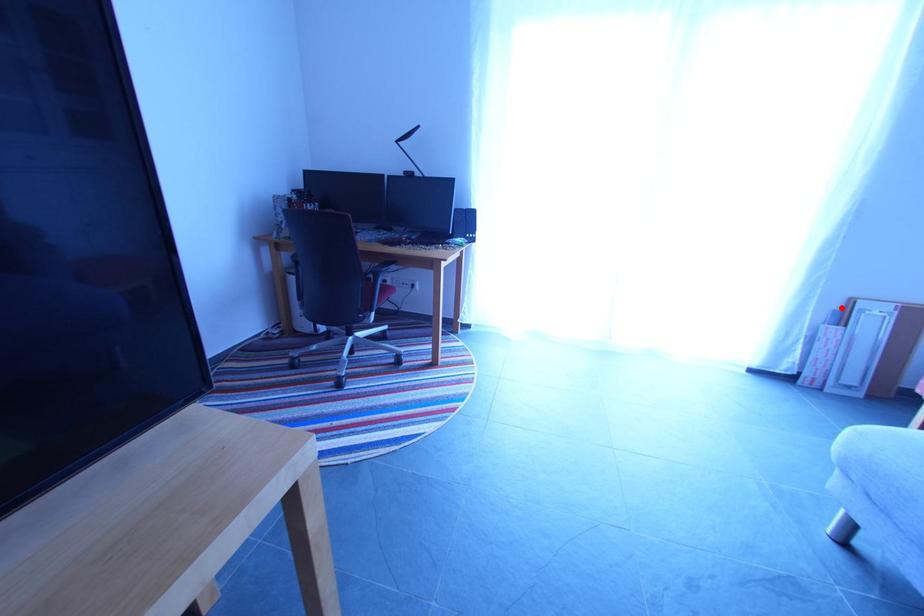
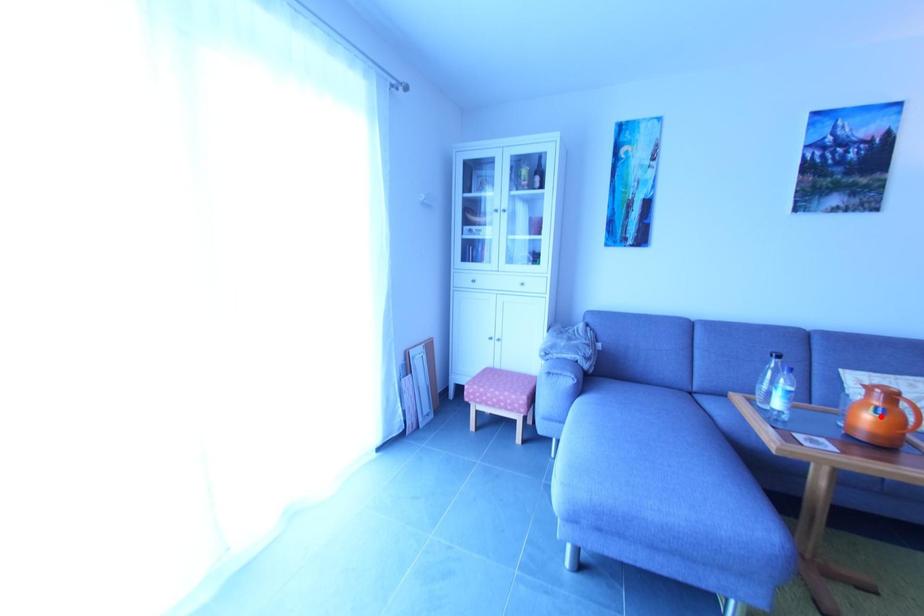
I am providing you with two images of the same scene from different viewpoints. A red point is marked on the first image and another point is marked on the second image. Do the highlighted points in image1 and image2 indicate the same real-world spot?

No